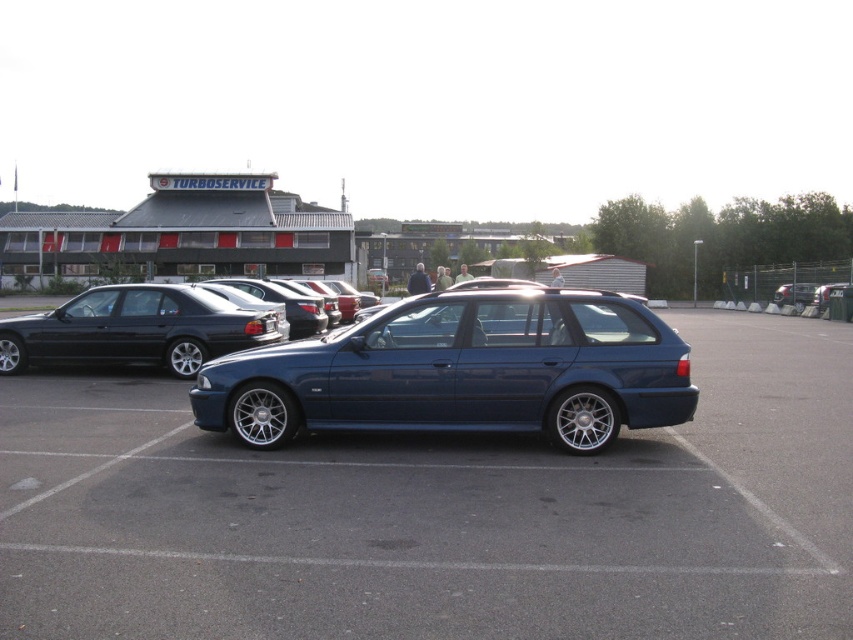
You are a delivery person trying to park your van between the shiny black sedan at left and the black plastic license plate at center. Can you fit your van there if it requires at least 2 meters of space?

The shiny black sedan at left is positioned on the left side of black plastic license plate at center, but the exact distance between them isn not provided. Without knowing the distance, it is impossible to determine if there is enough space for the van requiring 2 meters.

You are standing at point A, which is located at coordinates 0.5, 0.5. You want to walk to the glossy metallic car at center. Which direction should you move in to reach it?

Since the glossy metallic car at center is located at point (793, 292) and you are at point (426, 320), you should move downward and slightly to the left to reach it.